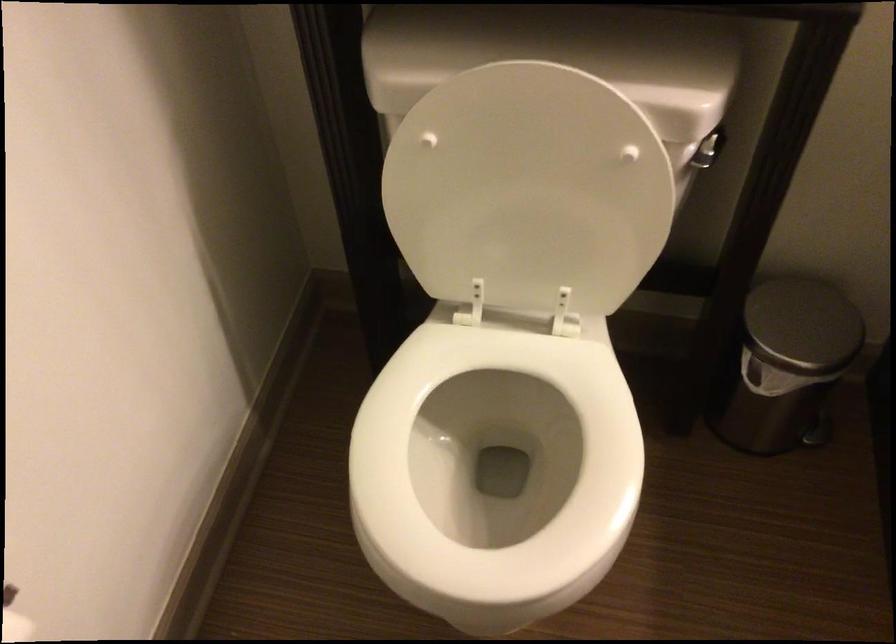
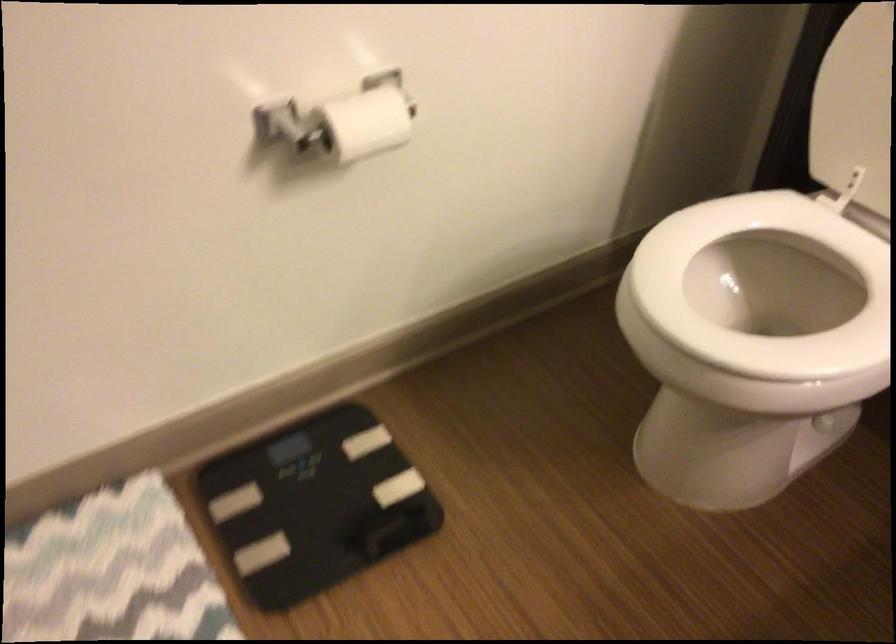
Question: How did the camera likely rotate?

Choices:
 (A) Left
 (B) Right
 (C) Up
 (D) Down

Answer: (A)